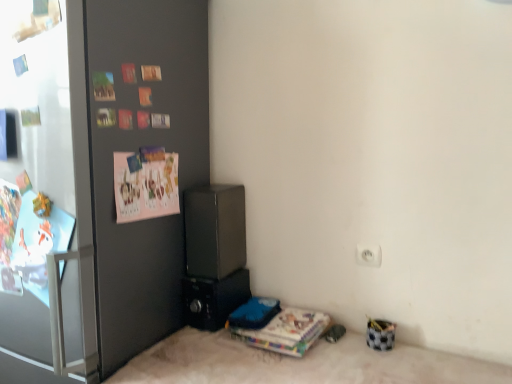
Locate an element on the screen. This screenshot has height=384, width=512. free space in front of multicolored paper stack at lower center is located at coordinates (285, 368).